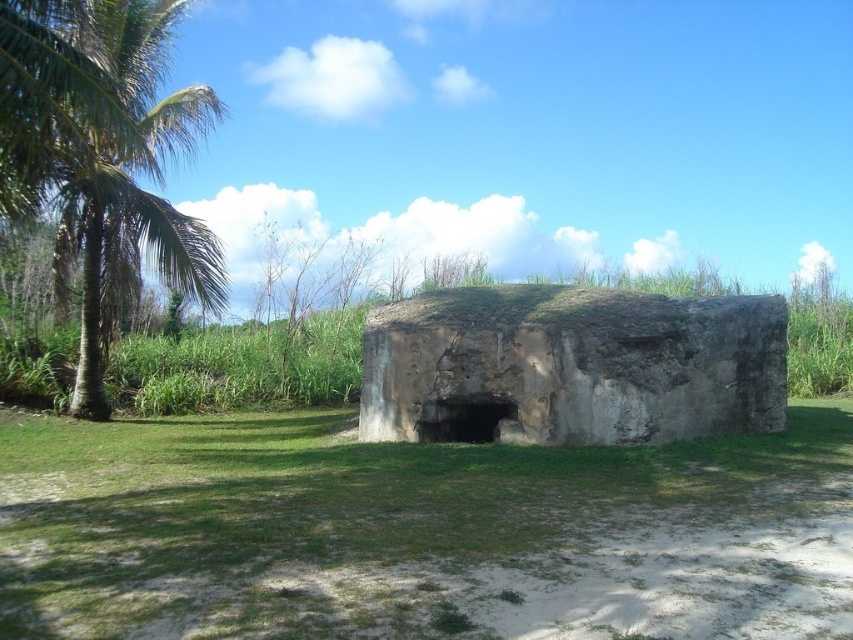
Question: Which object appears closest to the camera in this image?

Choices:
 (A) gray stone bunker at center
 (B) green leafy palm at left

Answer: (A)

Question: Can you confirm if gray stone bunker at center is positioned to the left of green leafy palm at left?

Choices:
 (A) yes
 (B) no

Answer: (B)

Question: Which of the following is the closest to the observer?

Choices:
 (A) (218, 244)
 (B) (364, 385)

Answer: (B)

Question: Is gray stone bunker at center to the left of green leafy palm at left from the viewer's perspective?

Choices:
 (A) yes
 (B) no

Answer: (B)

Question: Does gray stone bunker at center appear on the right side of green leafy palm at left?

Choices:
 (A) no
 (B) yes

Answer: (B)